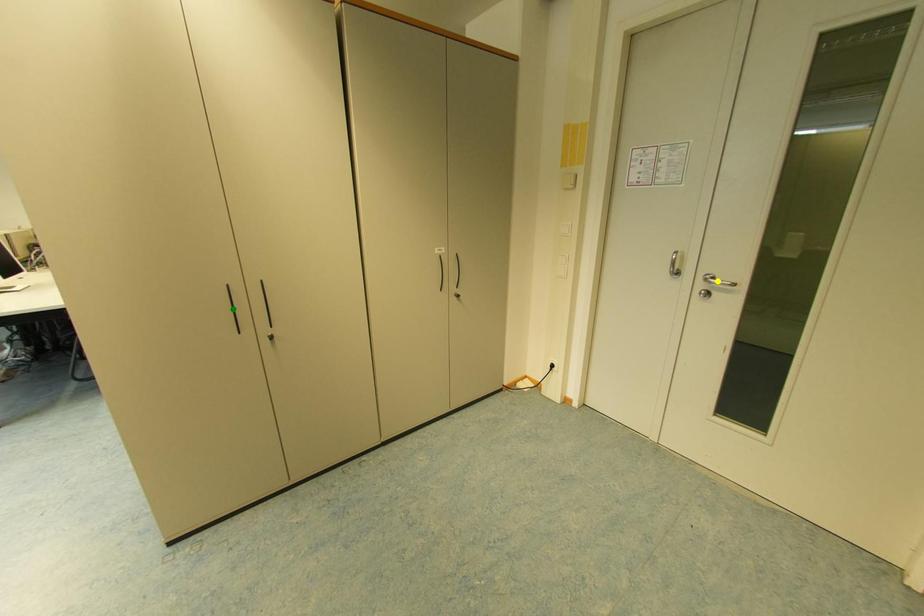
Order these from nearest to farthest:
- blue point
- yellow point
- green point

yellow point → blue point → green point